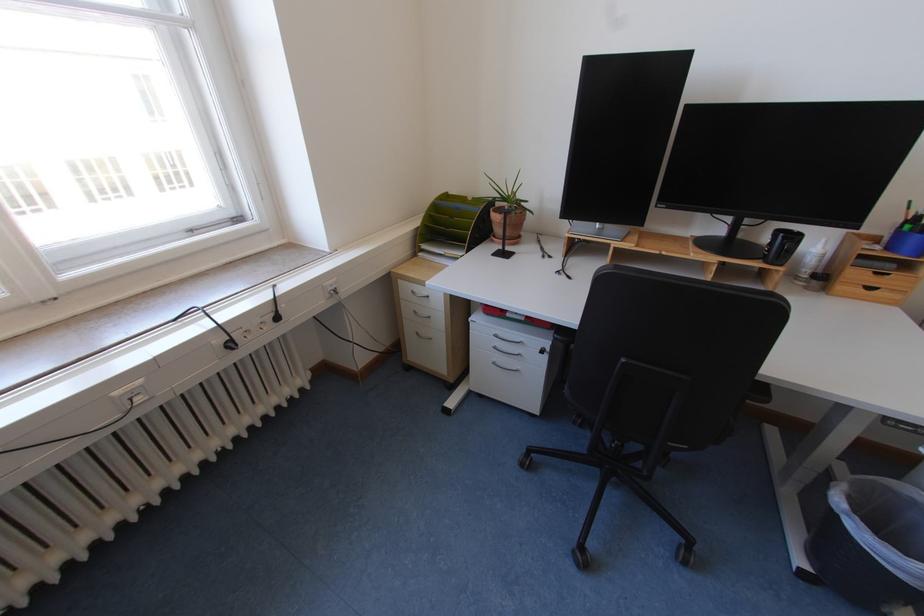
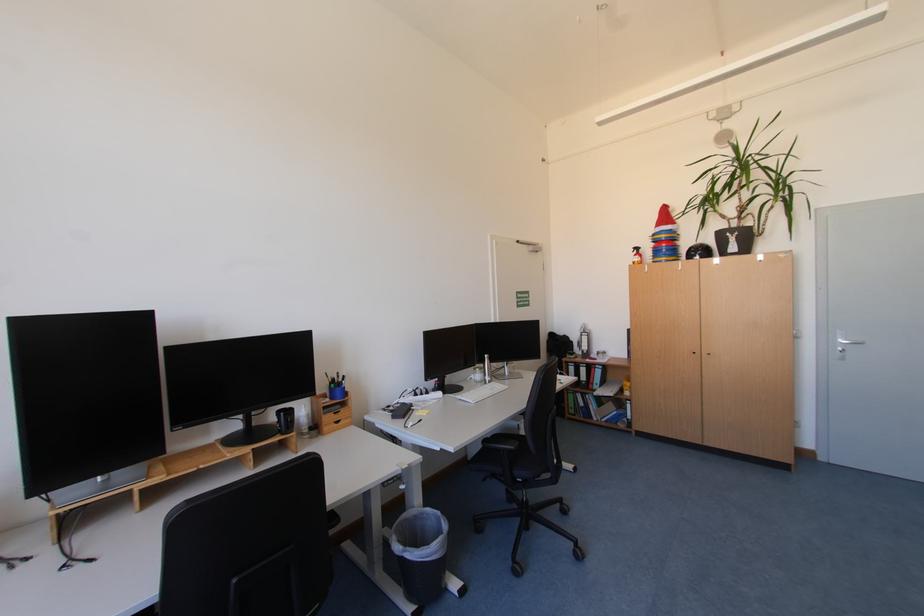
Question: The images are taken continuously from a first-person perspective. In which direction is your viewpoint rotating?

Choices:
 (A) Left
 (B) Right
 (C) Up
 (D) Down

Answer: (B)